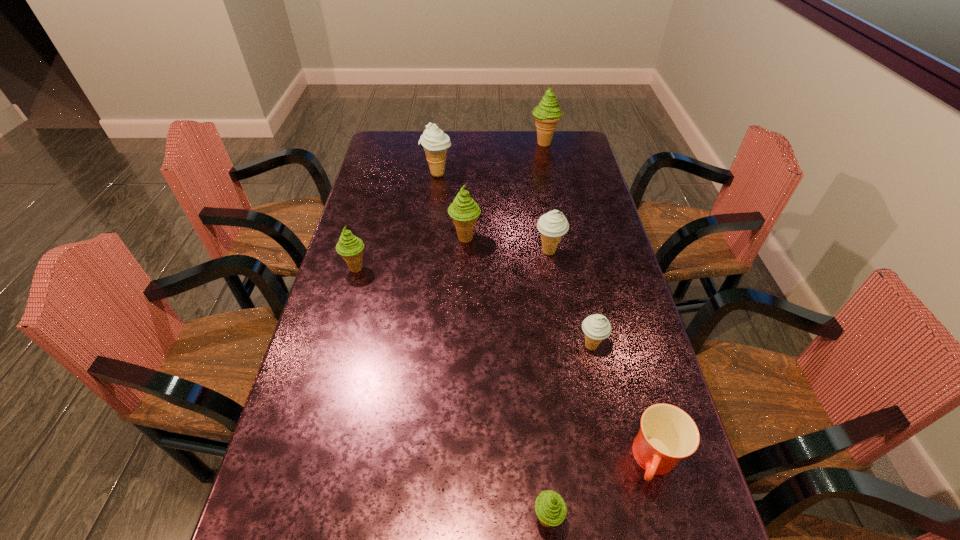
Where is `the sixth farthest icecream`? The width and height of the screenshot is (960, 540). the sixth farthest icecream is located at coordinates (596, 328).

Locate an element on the screen. The width and height of the screenshot is (960, 540). the nearest object is located at coordinates (550, 508).

Identify the location of the fifth object from right to left. (550, 508).

This screenshot has height=540, width=960. Identify the location of the second nearest object. (667, 434).

I want to click on vacant space located 0.080m on the left of the farthest icecream, so click(x=511, y=143).

Locate an element on the screen. This screenshot has width=960, height=540. vacant area situated 0.080m on the right of the sixth nearest icecream is located at coordinates (473, 174).

At what (x,y) coordinates should I click in order to perform the action: click on vacant space situated on the front of the second farthest green icecream. Please return your answer as a coordinate pair (x, y). The width and height of the screenshot is (960, 540). Looking at the image, I should click on (463, 308).

The height and width of the screenshot is (540, 960). What are the coordinates of `vacant region located 0.110m on the back of the second smallest green icecream` in the screenshot? It's located at (365, 237).

The width and height of the screenshot is (960, 540). I want to click on free space located 0.110m on the back of the second smallest beige icecream, so click(x=544, y=221).

Identify the location of vacant space positioned 0.090m on the back of the sixth farthest object. The height and width of the screenshot is (540, 960). (584, 309).